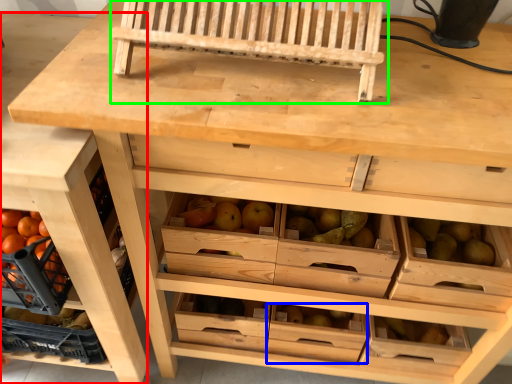
Question: Based on their relative distances, which object is nearer to shelf (highlighted by a red box)? Choose from drawer (highlighted by a blue box) and church bench (highlighted by a green box).

Choices:
 (A) drawer
 (B) church bench

Answer: (B)